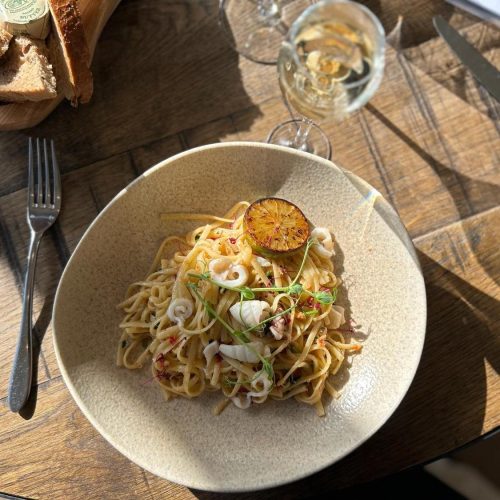
Locate an element on the screen. Image resolution: width=500 pixels, height=500 pixels. bowl of wineglass is located at coordinates click(x=355, y=89).